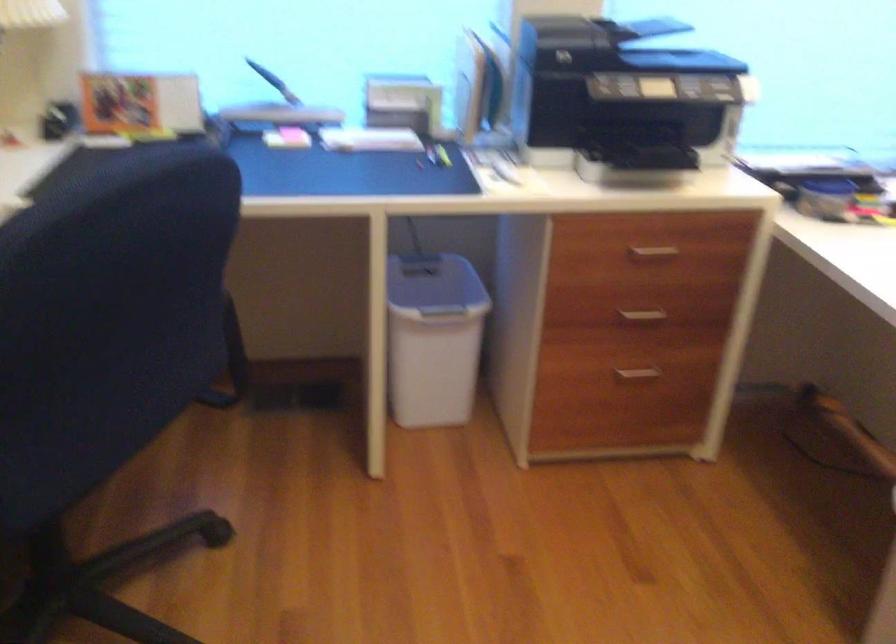
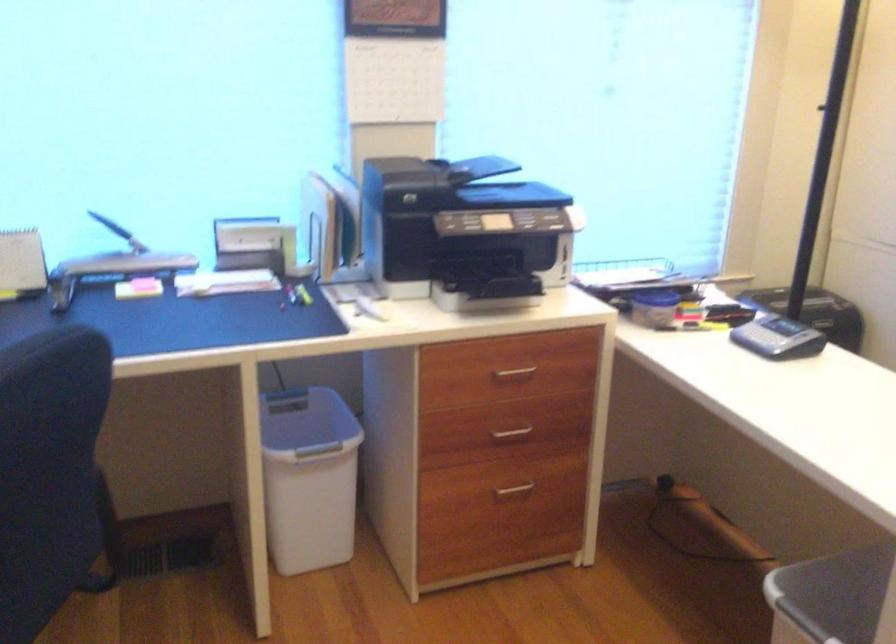
Question: Based on the continuous images, in which direction is the camera rotating? Reply with the corresponding letter.

Choices:
 (A) Left
 (B) Right
 (C) Up
 (D) Down

Answer: (B)